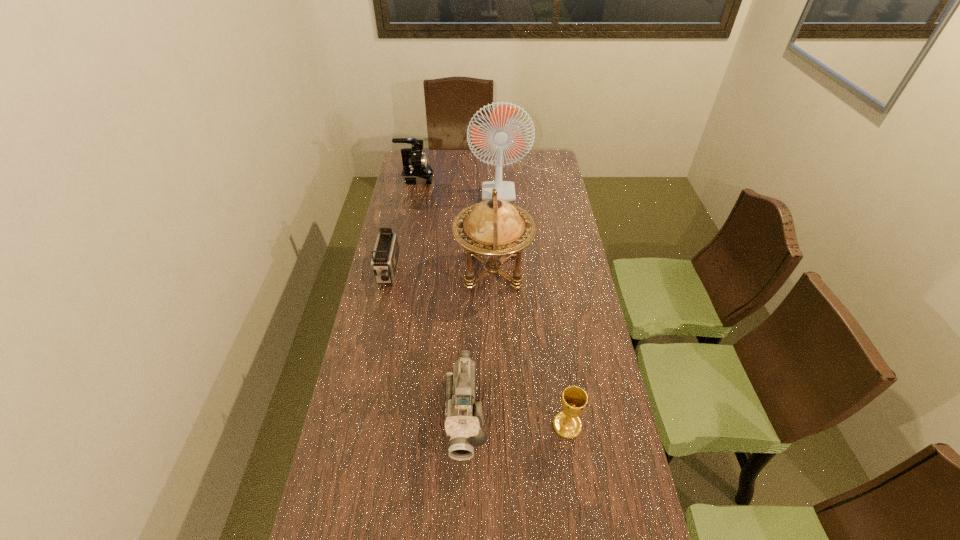
Where is `free space that satisfies the following two spatial constraints: 1. on the front-facing side of the globe; 2. on the left side of the chalice`? Image resolution: width=960 pixels, height=540 pixels. free space that satisfies the following two spatial constraints: 1. on the front-facing side of the globe; 2. on the left side of the chalice is located at coordinates (497, 425).

Find the location of a particular element. free space that satisfies the following two spatial constraints: 1. on the lens mount of the farthest camcorder; 2. at the lens of the second nearest camcorder is located at coordinates (398, 272).

Identify the location of vacant space that satisfies the following two spatial constraints: 1. on the front-facing side of the fan; 2. on the right side of the chalice. The height and width of the screenshot is (540, 960). (x=536, y=425).